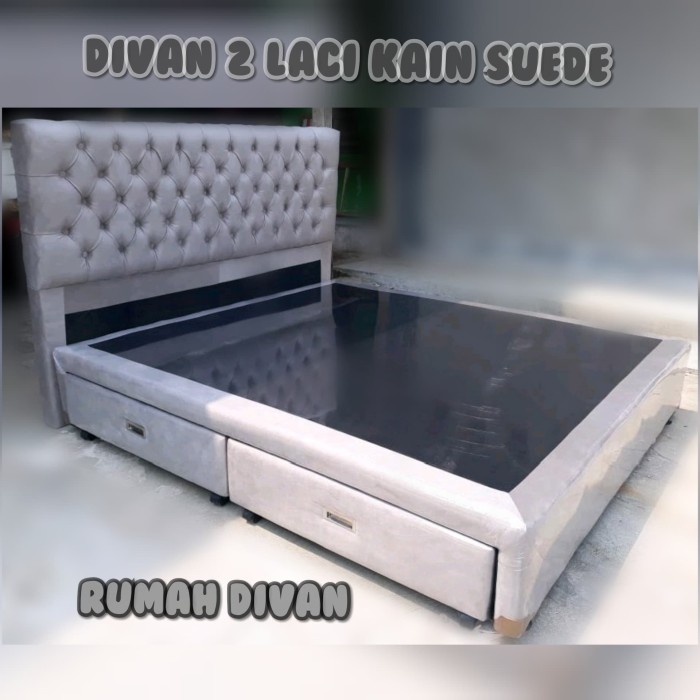
This screenshot has height=700, width=700. In order to click on drawers in this screenshot , I will do `click(152, 434)`.